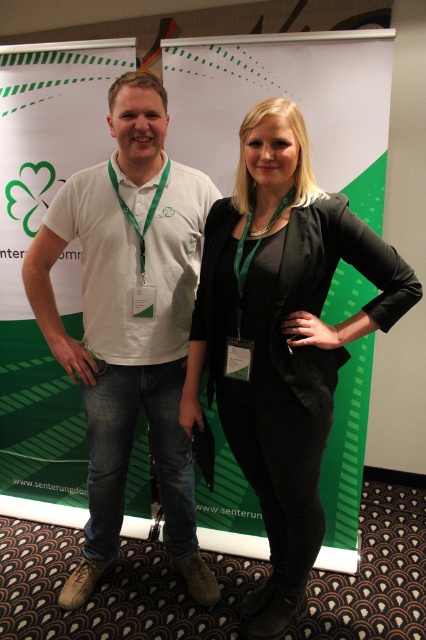
Does green fabric banner at center have a lesser height compared to white cotton polo shirt at left?

No, green fabric banner at center is not shorter than white cotton polo shirt at left.

In the scene shown: Who is more distant from viewer, (60,83) or (140,115)?

The point (60,83) is more distant.

You are a GUI agent. You are given a task and a screenshot of the screen. Output one action in this format:
    pyautogui.click(x=<x>, y=<y>)
    Task: Click on the green fabric banner at center
    
    Given the screenshot: What is the action you would take?
    pyautogui.click(x=23, y=253)

Does black leather blazer at center have a greater height compared to white cotton polo shirt at left?

Incorrect, black leather blazer at center's height is not larger of white cotton polo shirt at left's.

Can you confirm if black leather blazer at center is positioned to the right of white cotton polo shirt at left?

Yes, black leather blazer at center is to the right of white cotton polo shirt at left.

Measure the distance between black leather blazer at center and camera.

black leather blazer at center is 4.70 feet away from camera.

At what (x,y) coordinates should I click in order to perform the action: click on black leather blazer at center. Please return your answer as a coordinate pair (x, y). Looking at the image, I should click on (282, 339).

Which is in front, point (253, 547) or point (268, 145)?

Positioned in front is point (268, 145).

Who is higher up, green fabric banner at center or black leather blazer at center?

green fabric banner at center is higher up.

Between point (336, 188) and point (382, 275), which one is positioned in front?

Point (382, 275)

Find the location of a particular element. This screenshot has width=426, height=640. green fabric banner at center is located at coordinates (23, 253).